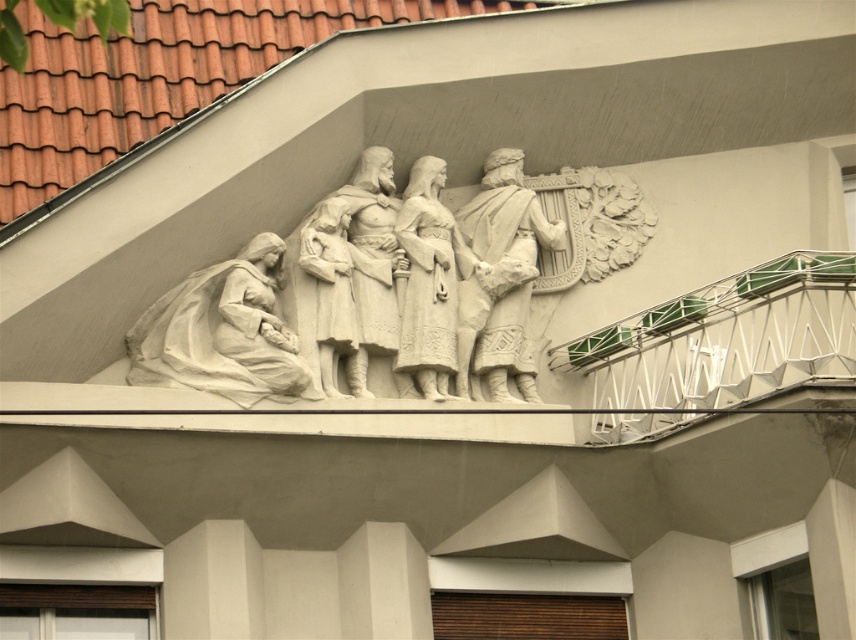
Question: Which point is farther to the camera?

Choices:
 (A) white stone figure at center
 (B) white stone carving at center
 (C) white stone harp at center
 (D) white stone figure at left

Answer: (C)

Question: Which of these objects is positioned closest to the white stone figure at left?

Choices:
 (A) white stone figure at center
 (B) white stone harp at center

Answer: (A)

Question: Based on their relative distances, which object is nearer to the white stone harp at center?

Choices:
 (A) white stone carving at center
 (B) white stone figure at center
 (C) white stone figure at left

Answer: (A)

Question: Can you confirm if white stone carving at center is smaller than white stone harp at center?

Choices:
 (A) yes
 (B) no

Answer: (B)

Question: Can you confirm if white stone figure at left is bigger than white stone harp at center?

Choices:
 (A) no
 (B) yes

Answer: (B)

Question: Does white stone figure at left have a smaller size compared to white stone figure at center?

Choices:
 (A) yes
 (B) no

Answer: (B)